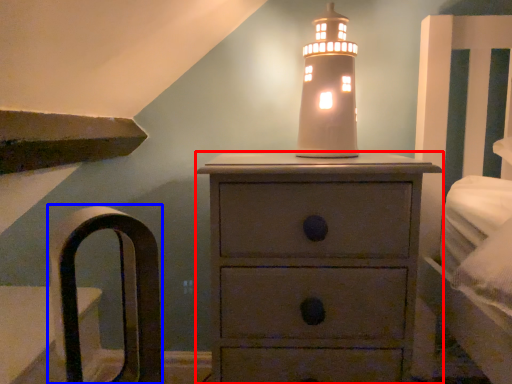
Question: Which object appears farthest to the camera in this image, chest of drawers (highlighted by a red box) or armchair (highlighted by a blue box)?

Choices:
 (A) chest of drawers
 (B) armchair

Answer: (A)